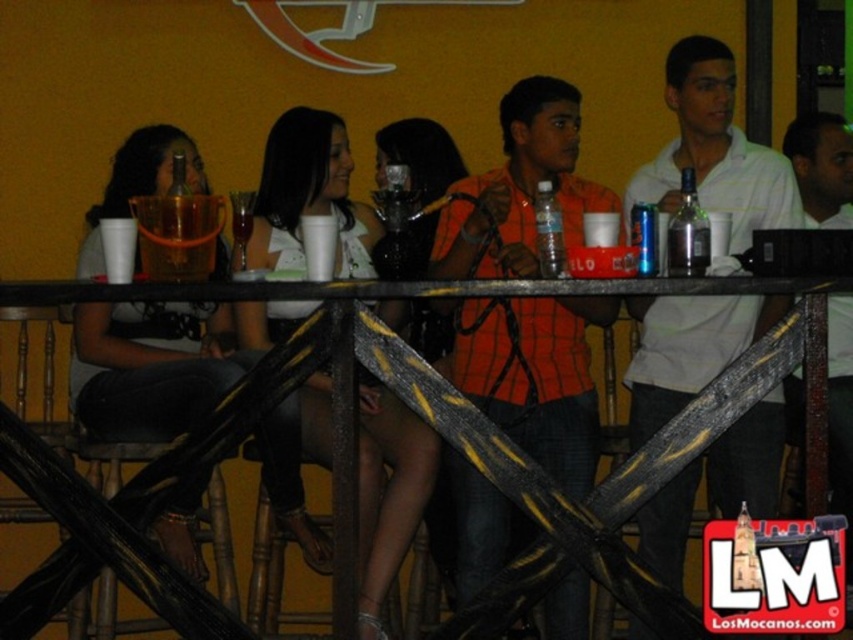
You are a bartender preparing to serve drinks to the guests seated at the black metal table at center and the white cotton shirt at upper right. Which guest is sitting at a lower height compared to the other?

The black metal table at center is shorter than the white cotton shirt at upper right, so the guest at the black metal table at center is sitting at a lower height compared to the white cotton shirt at upper right.

You are standing at the entrance of the bar and want to locate the person wearing the orange checkered shirt at center. According to the coordinates provided, where should you look to find them?

The orange checkered shirt at center is located at coordinates point (535, 378), so you should look towards the center of the image to find them.

You are a fashion designer observing the social scene. You notice two shirts in the crowd. The orange checkered shirt at center and the white cotton shirt at upper right. Which shirt has a greater width?

The orange checkered shirt at center has a greater width than the white cotton shirt at upper right.